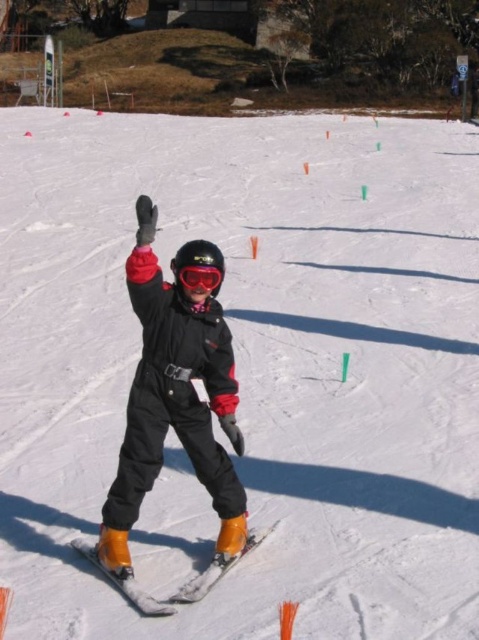
You are a GUI agent. You are given a task and a screenshot of the screen. Output one action in this format:
    pyautogui.click(x=<x>, y=<y>)
    Task: Click on the matte black snowsuit at center
    Image resolution: width=479 pixels, height=640 pixels.
    Given the screenshot: What is the action you would take?
    pyautogui.click(x=173, y=401)

Is matte black snowsuit at center wider than matte black goggles at center?

Indeed, matte black snowsuit at center has a greater width compared to matte black goggles at center.

At what (x,y) coordinates should I click in order to perform the action: click on matte black snowsuit at center. Please return your answer as a coordinate pair (x, y). This screenshot has height=640, width=479. Looking at the image, I should click on (173, 401).

Does point (184, 444) lie behind point (171, 598)?

Yes, it is.

Who is shorter, matte black snowsuit at center or orange matte ski at center?

orange matte ski at center is shorter.

Does point (117, 468) come closer to viewer compared to point (121, 566)?

That is False.

Locate an element on the screen. This screenshot has width=479, height=640. matte black snowsuit at center is located at coordinates (173, 401).

Can you confirm if orange matte ski at center is positioned to the left of matte black goggles at center?

Correct, you'll find orange matte ski at center to the left of matte black goggles at center.

Is point (93, 563) less distant than point (206, 264)?

No, (93, 563) is behind (206, 264).

In order to click on orange matte ski at center in this screenshot , I will do `click(180, 588)`.